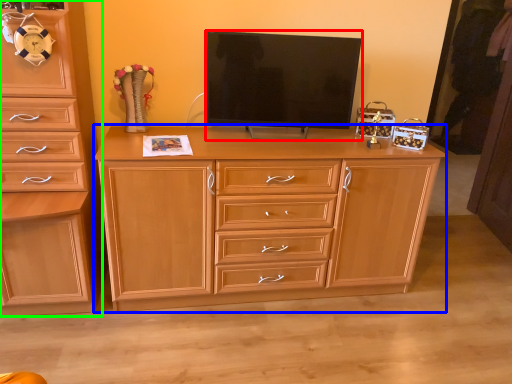
Question: Which object is positioned farthest from television (highlighted by a red box)? Select from chest of drawers (highlighted by a blue box) and chest of drawers (highlighted by a green box).

Choices:
 (A) chest of drawers
 (B) chest of drawers

Answer: (B)